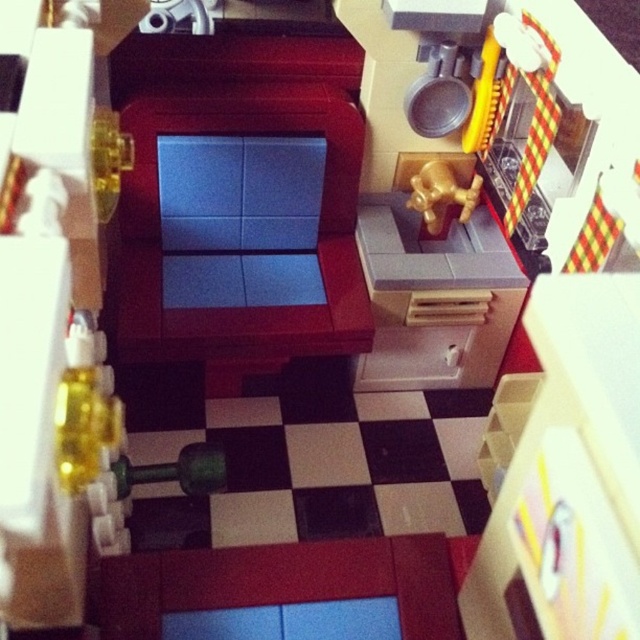
You are a LEGO designer working on a kitchen model. You need to place a new appliance in the kitchen. The appliance requires a space at point coordinates between 0.5 and 0.7 on the x and y axes. Is the white plastic drawer at center located within this area?

The white plastic drawer at center is located at point coordinates of 0.537 on the x and 0.692 on the y axes, which falls within the specified range between 0.5 and 0.7 on both axes. Therefore, the white plastic drawer at center is within the required area.

You are organizing the LEGO kitchen and need to place a small LEGO dish in the white plastic drawer at center and the gold metallic faucet at upper right. Which object should you place first if you want to follow the left to right order?

You should place the white plastic drawer at center first because it is to the left of the gold metallic faucet at upper right, so following left to right order, the drawer comes first.

You are organizing the LEGO kitchen and need to place a small LEGO toy inside the white plastic drawer at center. However, you notice the gold metallic faucet at upper right is in the way. Can you access the drawer without moving the faucet?

The white plastic drawer at center is positioned under the gold metallic faucet at upper right, so you can access the drawer by reaching underneath the faucet without needing to move it.